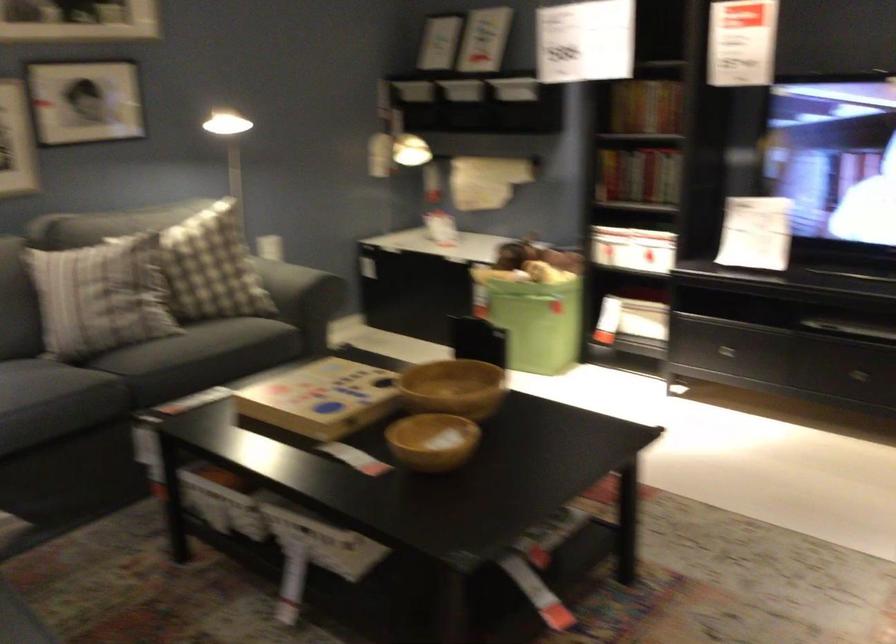
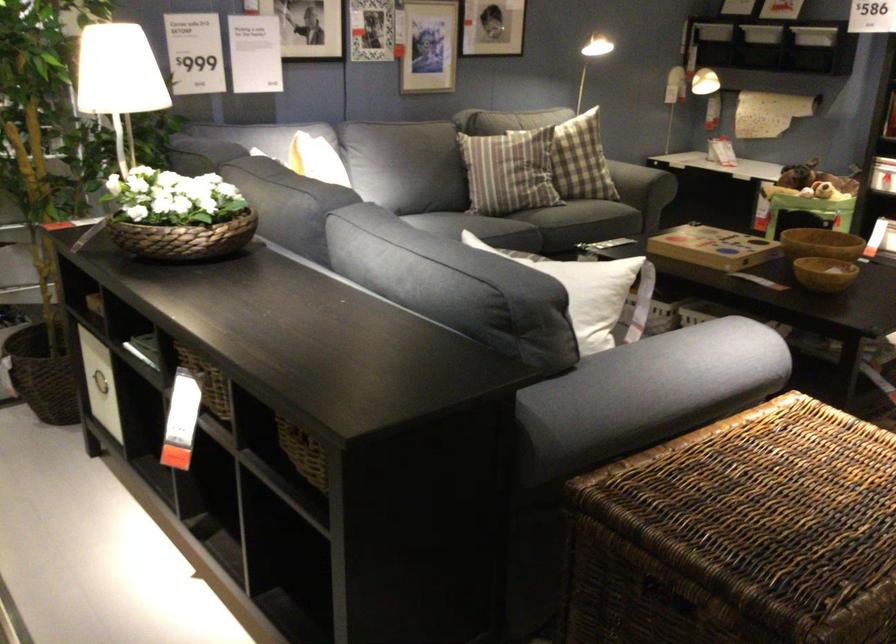
Question: I am providing you with two images of the same scene from different viewpoints. After the viewpoint changes to image2, which objects are now occluded?

Choices:
 (A) white box handle
 (B) plaid pillow
 (C) black serving tray
 (D) wooden bowl

Answer: (B)